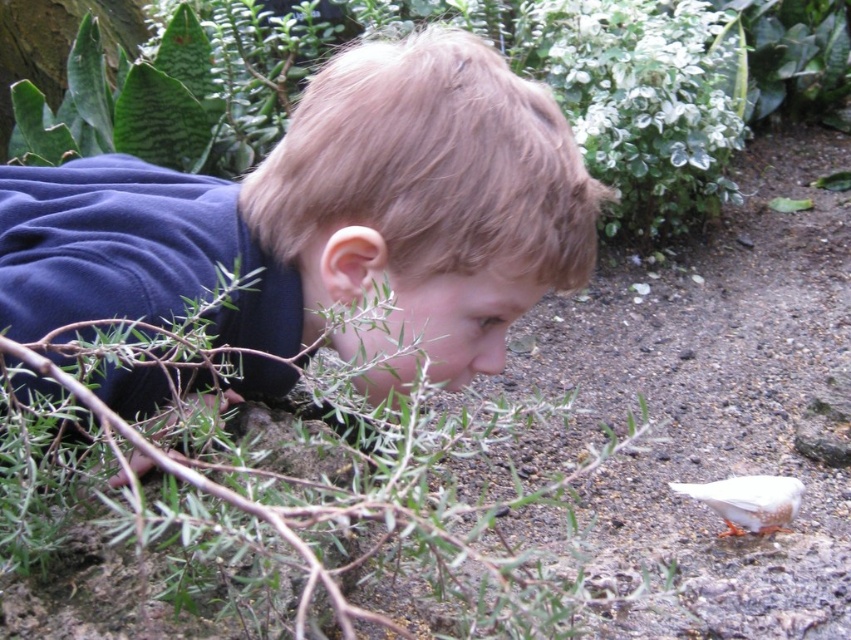
Find the location of a particular element. Image resolution: width=851 pixels, height=640 pixels. dark blue sweatshirt at center is located at coordinates (328, 214).

This screenshot has width=851, height=640. Find the location of `dark blue sweatshirt at center`. dark blue sweatshirt at center is located at coordinates (328, 214).

Who is shorter, dark blue sweatshirt at center or green leafy plant at center?

Standing shorter between the two is green leafy plant at center.

Which is behind, point (373, 125) or point (460, 557)?

The point (373, 125) is behind.

Find the location of `dark blue sweatshirt at center`. dark blue sweatshirt at center is located at coordinates (328, 214).

Does green leafy plant at center have a lesser height compared to white speckled feather at lower right?

In fact, green leafy plant at center may be taller than white speckled feather at lower right.

Is green leafy plant at center above white speckled feather at lower right?

Indeed, green leafy plant at center is positioned over white speckled feather at lower right.

The image size is (851, 640). What do you see at coordinates (290, 493) in the screenshot?
I see `green leafy plant at center` at bounding box center [290, 493].

Where is `green leafy plant at center`? The width and height of the screenshot is (851, 640). green leafy plant at center is located at coordinates (290, 493).